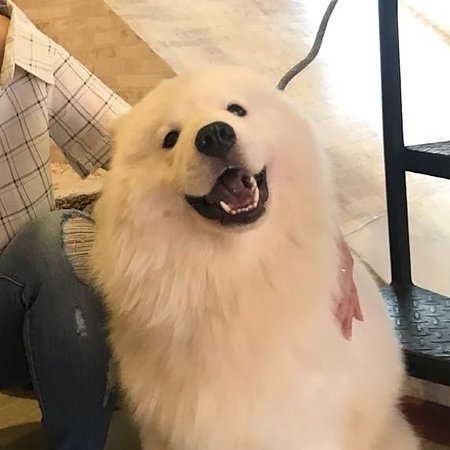
Where is `floor`? This screenshot has width=450, height=450. floor is located at coordinates (345, 87).